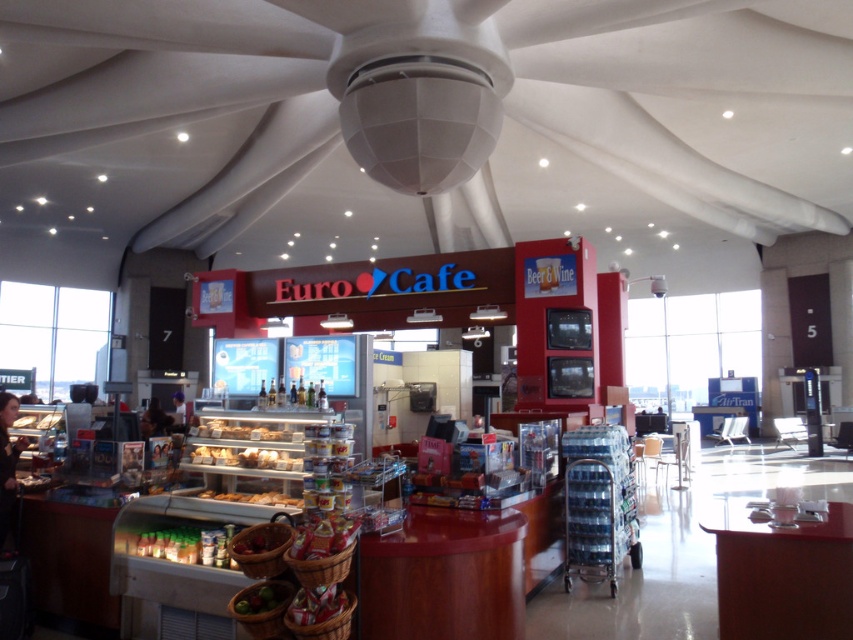
Is shiny red basket at center positioned behind shiny red apples at center?

No, it is in front of shiny red apples at center.

Find the location of `shiny red basket at center`. shiny red basket at center is located at coordinates (316, 604).